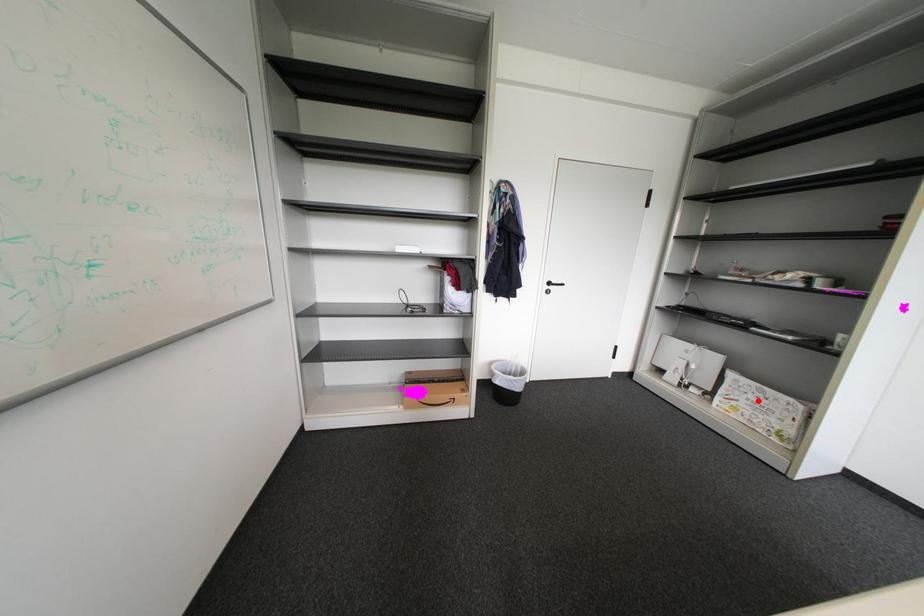
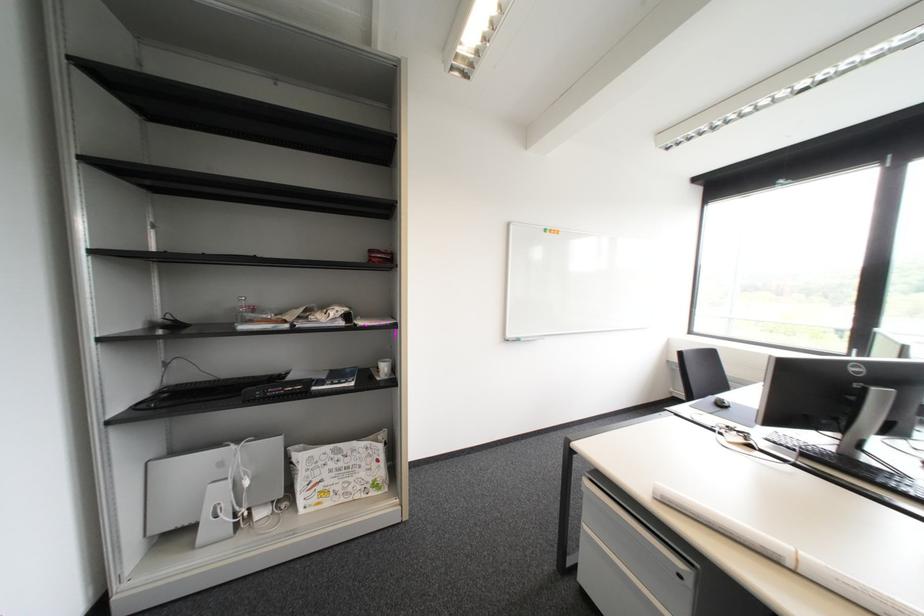
Find the pixel in the second image that matches the highlighted location in the first image.

(341, 472)